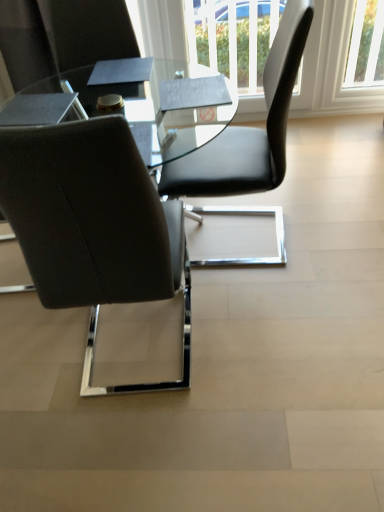
This screenshot has height=512, width=384. I want to click on free space to the left of matte black chair at left, the 2th chair from the right, so click(x=36, y=364).